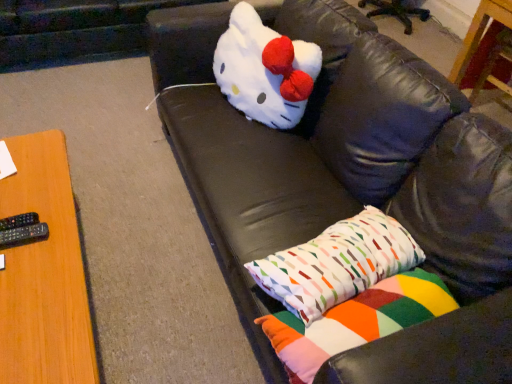
Question: From the image's perspective, is geometric-patterned fabric pillow at lower right, which is the 1th pillow in top-to-bottom order, positioned above or below multicolored fabric pillow at lower right, the second pillow when ordered from top to bottom?

Choices:
 (A) below
 (B) above

Answer: (B)

Question: Considering the positions of geometric-patterned fabric pillow at lower right, which is the 1th pillow in top-to-bottom order, and multicolored fabric pillow at lower right, the second pillow when ordered from top to bottom, in the image, is geometric-patterned fabric pillow at lower right, which is the 1th pillow in top-to-bottom order, bigger or smaller than multicolored fabric pillow at lower right, the second pillow when ordered from top to bottom,?

Choices:
 (A) big
 (B) small

Answer: (A)

Question: Considering the real-world distances, which object is farthest from the geometric-patterned fabric pillow at lower right, which is the 1th pillow in top-to-bottom order?

Choices:
 (A) black leather couch at upper center
 (B) multicolored fabric pillow at lower right, the 1th pillow ordered from the bottom
 (C) wooden table at left, marked as the 2th table in a back-to-front arrangement
 (D) black plastic remote at left, which is counted as the first remote, starting from the top
 (E) wooden table at upper right, acting as the second table starting from the left

Answer: (E)

Question: Which is nearer to the geometric-patterned fabric pillow at lower right, which is the 1th pillow in top-to-bottom order?

Choices:
 (A) wooden table at left, placed as the second table when sorted from top to bottom
 (B) white plush toy at center
 (C) multicolored fabric pillow at lower right, the 1th pillow ordered from the bottom
 (D) wooden table at upper right, which appears as the first table when viewed from the back
 (E) black plastic remote at left, the second remote positioned from the bottom

Answer: (C)